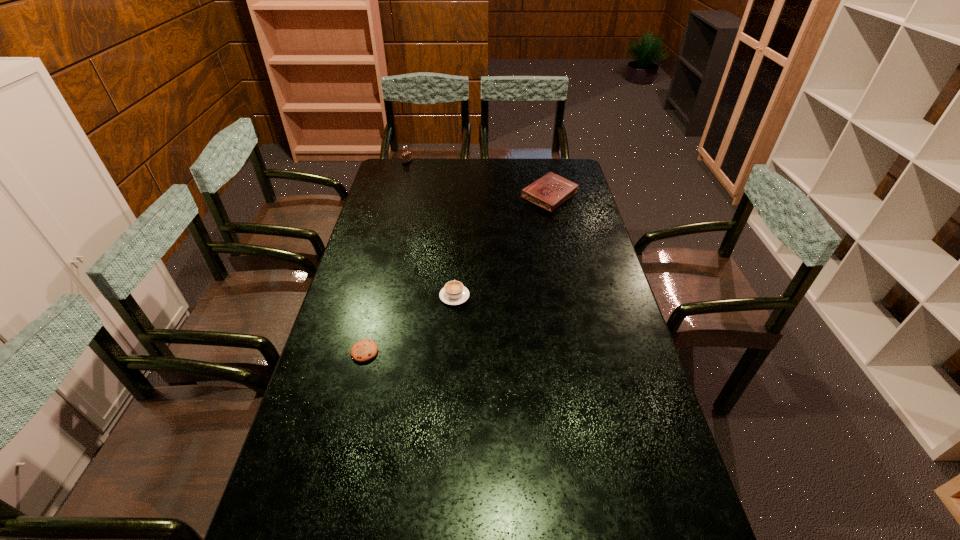
The width and height of the screenshot is (960, 540). I want to click on vacant space located 0.080m on the side of the cappuccino with the handle, so pyautogui.click(x=456, y=271).

I want to click on free space located 0.270m on the side of the cappuccino with the handle, so click(458, 238).

The image size is (960, 540). In order to click on free spot located 0.200m on the side of the cappuccino with the handle in this screenshot , I will do `click(457, 249)`.

At what (x,y) coordinates should I click in order to perform the action: click on vacant area located 0.190m on the right of the nearest object. Please return your answer as a coordinate pair (x, y). Image resolution: width=960 pixels, height=540 pixels. Looking at the image, I should click on (443, 352).

Locate an element on the screen. The image size is (960, 540). padlock situated at the far edge is located at coordinates (406, 157).

The width and height of the screenshot is (960, 540). In order to click on hardback book positioned at the far edge in this screenshot , I will do `click(550, 191)`.

Identify the location of padlock that is at the left edge. The height and width of the screenshot is (540, 960). (406, 157).

Identify the location of cookie situated at the left edge. The height and width of the screenshot is (540, 960). (364, 350).

Locate an element on the screen. This screenshot has width=960, height=540. object located in the right edge section of the desktop is located at coordinates (550, 191).

Find the location of `object at the far left corner`. object at the far left corner is located at coordinates (406, 157).